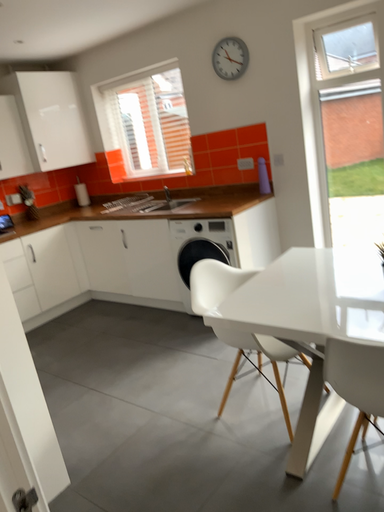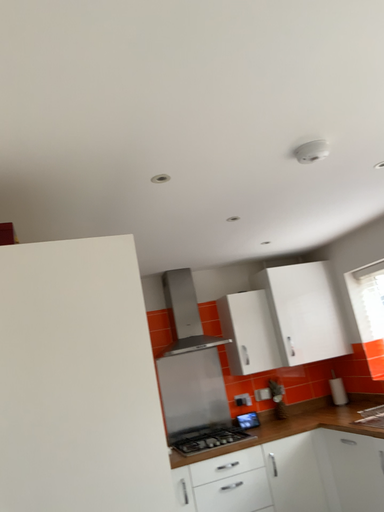
Question: How did the camera likely rotate when shooting the video?

Choices:
 (A) rotated left
 (B) rotated right

Answer: (A)